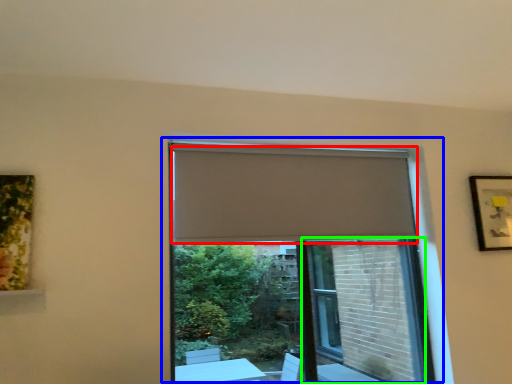
Question: Based on their relative distances, which object is farther from curtain (highlighted by a red box)? Choose from window (highlighted by a blue box) and screen door (highlighted by a green box).

Choices:
 (A) window
 (B) screen door

Answer: (A)